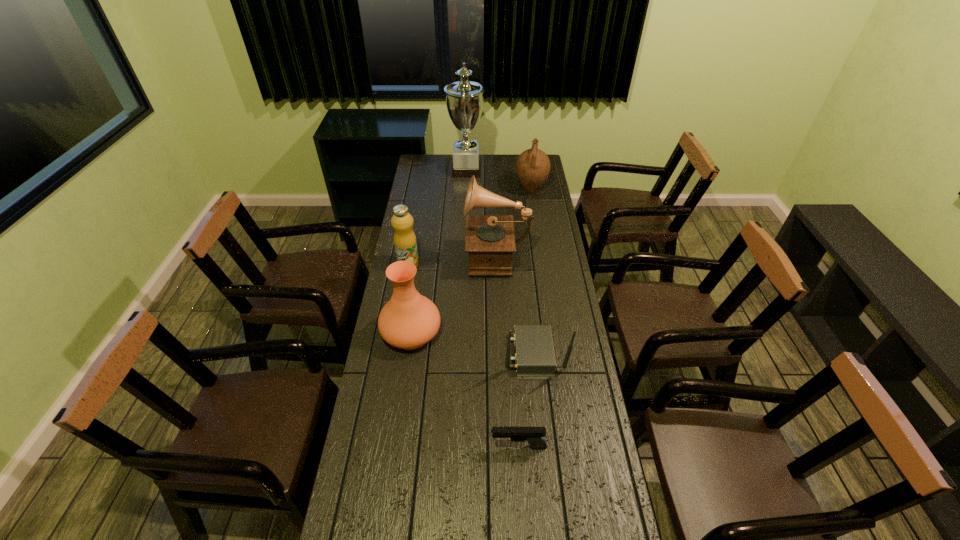
In order to click on trophy cup in this screenshot , I will do `click(464, 99)`.

The height and width of the screenshot is (540, 960). What are the coordinates of `record player` in the screenshot? It's located at (490, 240).

You are a GUI agent. You are given a task and a screenshot of the screen. Output one action in this format:
    pyautogui.click(x=<x>, y=<y>)
    Task: Click on the vase
    Image resolution: width=960 pixels, height=540 pixels.
    Given the screenshot: What is the action you would take?
    coord(409,320)

Find the location of `fruit juice`. fruit juice is located at coordinates (405, 243).

Where is `pitcher`? This screenshot has width=960, height=540. pitcher is located at coordinates (533, 166).

The width and height of the screenshot is (960, 540). What are the coordinates of `router` in the screenshot? It's located at (534, 357).

This screenshot has width=960, height=540. Identify the location of the nearest object. (533, 435).

What are the coordinates of `pistol` in the screenshot? It's located at (533, 435).

Locate an element on the screen. Image resolution: width=960 pixels, height=540 pixels. free space located at the front view of the trophy cup is located at coordinates (x=535, y=171).

At what (x,y) coordinates should I click in order to perform the action: click on vacant region located 0.250m on the horn of the record player. Please return your answer as a coordinate pair (x, y). The width and height of the screenshot is (960, 540). Looking at the image, I should click on (409, 254).